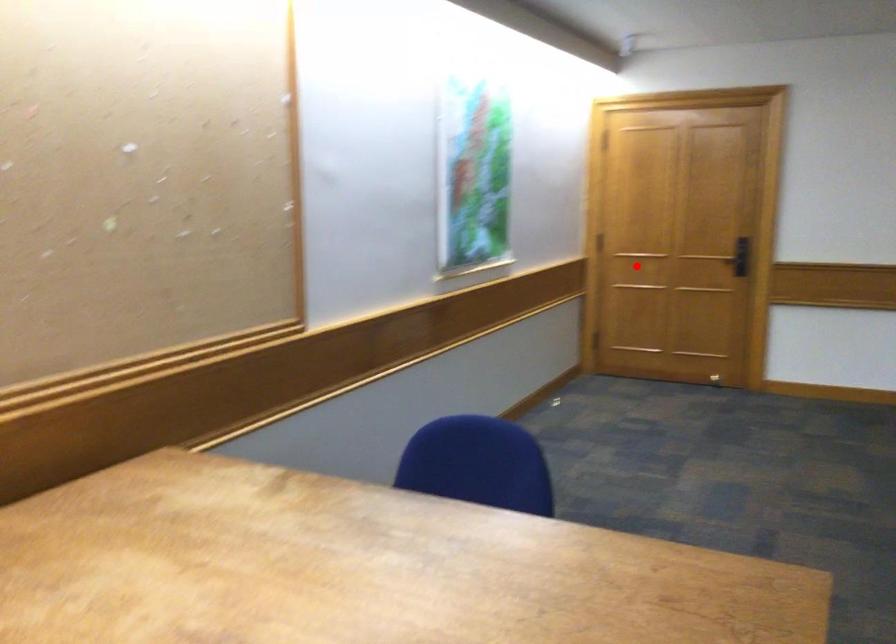
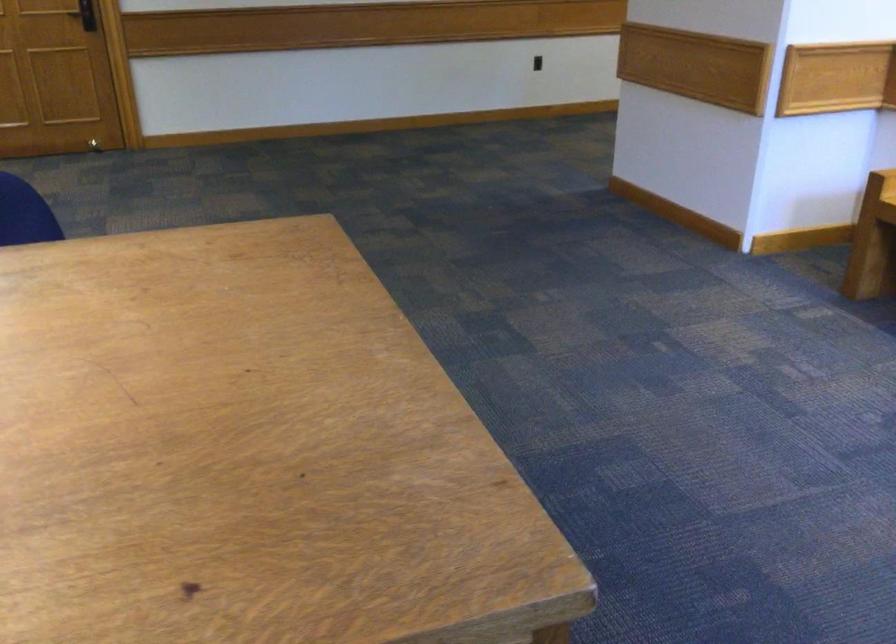
Question: I am providing you with two images of the same scene from different viewpoints. In image1, a red point is highlighted. Considering the same 3D point in image2, which of the following is correct?

Choices:
 (A) It is closer
 (B) It is farther

Answer: (A)